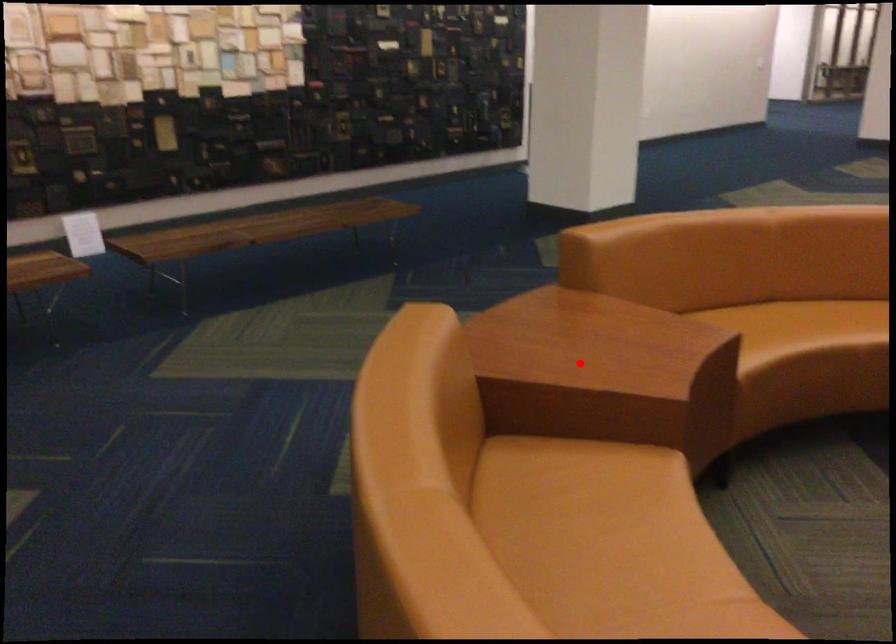
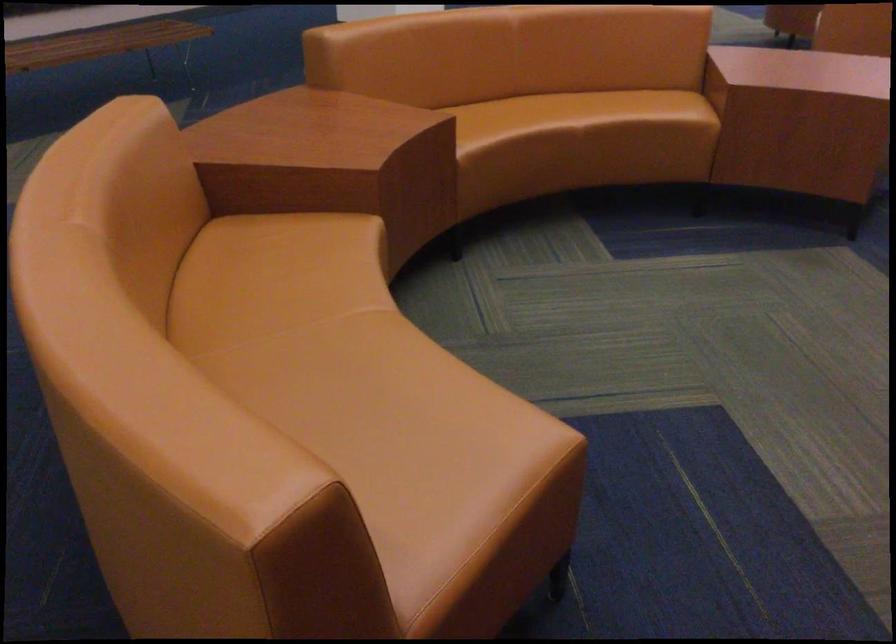
Question: A red point is marked in image1. In image2, is the corresponding 3D point closer to the camera or farther? Reply with the corresponding letter.

Choices:
 (A) The corresponding 3D point is closer.
 (B) The corresponding 3D point is farther.

Answer: (B)